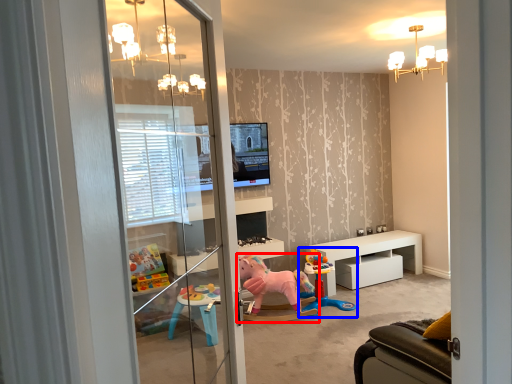
Question: Which object appears closest to the camera in this image, toy (highlighted by a red box) or toy (highlighted by a blue box)?

Choices:
 (A) toy
 (B) toy

Answer: (A)